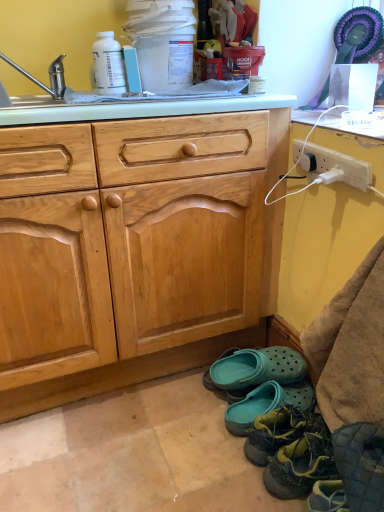
The height and width of the screenshot is (512, 384). What do you see at coordinates (107, 65) in the screenshot?
I see `white plastic bottle at upper left` at bounding box center [107, 65].

The height and width of the screenshot is (512, 384). I want to click on teal rubber clogs at lower center, which ranks as the second footwear in back-to-front order, so click(267, 404).

The height and width of the screenshot is (512, 384). What do you see at coordinates (300, 467) in the screenshot?
I see `green rubber shoes at lower right, the fourth footwear positioned from the back` at bounding box center [300, 467].

Identify the location of green rubber shoes at lower right, the fourth footwear positioned from the back. This screenshot has height=512, width=384. [300, 467].

You are a GUI agent. You are given a task and a screenshot of the screen. Output one action in this format:
    pyautogui.click(x=<x>, y=<y>)
    Task: Click on the white glossy countertop at upper right
    This screenshot has width=384, height=512.
    Given the screenshot: What is the action you would take?
    pyautogui.click(x=356, y=124)

Describe the element at coordinates (332, 165) in the screenshot. I see `white plastic power outlet at right` at that location.

The height and width of the screenshot is (512, 384). I want to click on white plastic power outlet at right, so click(x=332, y=165).

Where is `white plastic bottle at upper left`? The height and width of the screenshot is (512, 384). white plastic bottle at upper left is located at coordinates (107, 65).

Which point is more distant from viewer, (369, 178) or (37, 84)?

The point (37, 84) is behind.

Which is in front, white plastic power outlet at right or brushed metal faucet at upper left?

white plastic power outlet at right is in front.

Locate an element on the screen. power outlet to the right of brushed metal faucet at upper left is located at coordinates tap(332, 165).

In the scene shown: From a real-world perspective, which is physically below, white plastic power outlet at right or brushed metal faucet at upper left?

In real-world perspective, white plastic power outlet at right is lower.

In the image, is white plastic bottle at upper left on the left side or the right side of teal rubber clogs at lower right, acting as the 2th footwear starting from the front?

white plastic bottle at upper left is positioned on teal rubber clogs at lower right, acting as the 2th footwear starting from the front,'s left side.

Does point (115, 59) appear closer or farther from the camera than point (312, 423)?

Clearly, point (115, 59) is more distant from the camera than point (312, 423).

Is white plastic bottle at upper left thinner than teal rubber clogs at lower right, acting as the 2th footwear starting from the front?

Yes, white plastic bottle at upper left is thinner than teal rubber clogs at lower right, acting as the 2th footwear starting from the front.

Is white plastic bottle at upper left next to teal rubber clogs at lower right, which appears as the 3th footwear when viewed from the back, and touching it?

No, white plastic bottle at upper left is not next to teal rubber clogs at lower right, which appears as the 3th footwear when viewed from the back.

In terms of height, does white glossy countertop at upper right look taller or shorter compared to teal rubber clogs at lower center, placed as the third footwear when sorted from front to back?

In the image, white glossy countertop at upper right appears to be shorter than teal rubber clogs at lower center, placed as the third footwear when sorted from front to back.

From a real-world perspective, is white glossy countertop at upper right under teal rubber clogs at lower center, placed as the third footwear when sorted from front to back?

No, from a real-world perspective, white glossy countertop at upper right is not beneath teal rubber clogs at lower center, placed as the third footwear when sorted from front to back.

Does point (361, 120) come closer to viewer compared to point (269, 399)?

Yes, point (361, 120) is closer to viewer.

Considering the relative sizes of teal rubber clogs at lower right, which appears as the 3th footwear when viewed from the back, and teal rubber clogs at lower center, placed as the third footwear when sorted from front to back, in the image provided, is teal rubber clogs at lower right, which appears as the 3th footwear when viewed from the back, smaller than teal rubber clogs at lower center, placed as the third footwear when sorted from front to back,?

Actually, teal rubber clogs at lower right, which appears as the 3th footwear when viewed from the back, might be larger than teal rubber clogs at lower center, placed as the third footwear when sorted from front to back.

Would you say teal rubber clogs at lower right, acting as the 2th footwear starting from the front, is a long distance from teal rubber clogs at lower center, placed as the third footwear when sorted from front to back?

That's not correct — teal rubber clogs at lower right, acting as the 2th footwear starting from the front, is a little close to teal rubber clogs at lower center, placed as the third footwear when sorted from front to back.

Measure the distance from teal rubber clogs at lower right, which appears as the 3th footwear when viewed from the back, to teal rubber clogs at lower center, placed as the third footwear when sorted from front to back.

teal rubber clogs at lower right, which appears as the 3th footwear when viewed from the back, is 2.96 inches from teal rubber clogs at lower center, placed as the third footwear when sorted from front to back.

Do you think teal rubber clogs at lower right, acting as the 2th footwear starting from the front, is within teal rubber clogs at lower center, which ranks as the second footwear in back-to-front order, or outside of it?

teal rubber clogs at lower right, acting as the 2th footwear starting from the front, is outside teal rubber clogs at lower center, which ranks as the second footwear in back-to-front order.

Who is shorter, white plastic bottle at upper left or green rubber shoes at lower right, acting as the first footwear starting from the front?

green rubber shoes at lower right, acting as the first footwear starting from the front.

Could you tell me if white plastic bottle at upper left is turned towards green rubber shoes at lower right, the fourth footwear positioned from the back?

No.

How different are the orientations of white plastic bottle at upper left and green rubber shoes at lower right, the fourth footwear positioned from the back, in degrees?

There is a 108-degree angle between the facing directions of white plastic bottle at upper left and green rubber shoes at lower right, the fourth footwear positioned from the back.

From a real-world perspective, is white plastic bottle at upper left on top of green rubber shoes at lower right, the fourth footwear positioned from the back?

Correct, in the physical world, white plastic bottle at upper left is higher than green rubber shoes at lower right, the fourth footwear positioned from the back.

Identify the location of the 3rd footwear positioned below the white plastic power outlet at right (from a real-world perspective). (258, 368).

How far apart are white plastic power outlet at right and teal rubber clogs at lower center, which appears as the first footwear when viewed from the back?

61.28 centimeters.

Is white plastic power outlet at right located outside teal rubber clogs at lower center, which appears as the first footwear when viewed from the back?

Yes.

Considering the sizes of objects teal rubber clogs at lower center, which is counted as the 4th footwear, starting from the front, and teal rubber clogs at lower right, which appears as the 3th footwear when viewed from the back, in the image provided, who is smaller, teal rubber clogs at lower center, which is counted as the 4th footwear, starting from the front, or teal rubber clogs at lower right, which appears as the 3th footwear when viewed from the back,?

teal rubber clogs at lower center, which is counted as the 4th footwear, starting from the front, is smaller.

Considering the relative sizes of teal rubber clogs at lower center, which is counted as the 4th footwear, starting from the front, and teal rubber clogs at lower right, which appears as the 3th footwear when viewed from the back, in the image provided, is teal rubber clogs at lower center, which is counted as the 4th footwear, starting from the front, taller than teal rubber clogs at lower right, which appears as the 3th footwear when viewed from the back,?

In fact, teal rubber clogs at lower center, which is counted as the 4th footwear, starting from the front, may be shorter than teal rubber clogs at lower right, which appears as the 3th footwear when viewed from the back.

Could you measure the distance between teal rubber clogs at lower center, which appears as the first footwear when viewed from the back, and teal rubber clogs at lower right, which appears as the 3th footwear when viewed from the back?

teal rubber clogs at lower center, which appears as the first footwear when viewed from the back, is 7.27 inches away from teal rubber clogs at lower right, which appears as the 3th footwear when viewed from the back.

From a real-world perspective, is teal rubber clogs at lower center, which is counted as the 4th footwear, starting from the front, under teal rubber clogs at lower right, which appears as the 3th footwear when viewed from the back?

Correct, in the physical world, teal rubber clogs at lower center, which is counted as the 4th footwear, starting from the front, is lower than teal rubber clogs at lower right, which appears as the 3th footwear when viewed from the back.

Where is `power outlet that is on the right side of brushed metal faucet at upper left`? The image size is (384, 512). power outlet that is on the right side of brushed metal faucet at upper left is located at coordinates (332, 165).

Locate an element on the screen. The height and width of the screenshot is (512, 384). the 2nd footwear in front of the white plastic bottle at upper left is located at coordinates pyautogui.click(x=280, y=432).

Based on their spatial positions, is teal rubber clogs at lower center, which appears as the first footwear when viewed from the back, or green rubber shoes at lower right, the fourth footwear positioned from the back, further from teal rubber clogs at lower right, acting as the 2th footwear starting from the front?

The object further to teal rubber clogs at lower right, acting as the 2th footwear starting from the front, is teal rubber clogs at lower center, which appears as the first footwear when viewed from the back.

Looking at the image, which one is located closer to white plastic power outlet at right, white glossy countertop at upper right or teal rubber clogs at lower center, which is counted as the 4th footwear, starting from the front?

The object closer to white plastic power outlet at right is white glossy countertop at upper right.

Looking at the image, which one is located further to white plastic bottle at upper left, white glossy countertop at upper right or green rubber shoes at lower right, the fourth footwear positioned from the back?

The object further to white plastic bottle at upper left is green rubber shoes at lower right, the fourth footwear positioned from the back.

From the image, which object appears to be farther from teal rubber clogs at lower center, which appears as the first footwear when viewed from the back, white plastic power outlet at right or brushed metal faucet at upper left?

Based on the image, brushed metal faucet at upper left appears to be further to teal rubber clogs at lower center, which appears as the first footwear when viewed from the back.

In the scene shown: Estimate the real-world distances between objects in this image. Which object is closer to white plastic power outlet at right, teal rubber clogs at lower center, which ranks as the second footwear in back-to-front order, or white glossy countertop at upper right?

white glossy countertop at upper right.

From the image, which object appears to be farther from brushed metal faucet at upper left, teal rubber clogs at lower center, which is counted as the 4th footwear, starting from the front, or white plastic bottle at upper left?

teal rubber clogs at lower center, which is counted as the 4th footwear, starting from the front, is further to brushed metal faucet at upper left.

Estimate the real-world distances between objects in this image. Which object is further from teal rubber clogs at lower right, acting as the 2th footwear starting from the front, brushed metal faucet at upper left or teal rubber clogs at lower center, placed as the third footwear when sorted from front to back?

brushed metal faucet at upper left.

Based on their spatial positions, is teal rubber clogs at lower center, placed as the third footwear when sorted from front to back, or white plastic power outlet at right closer to green rubber shoes at lower right, the fourth footwear positioned from the back?

teal rubber clogs at lower center, placed as the third footwear when sorted from front to back, lies closer to green rubber shoes at lower right, the fourth footwear positioned from the back, than the other object.

I want to click on power outlet between white glossy countertop at upper right and teal rubber clogs at lower center, which ranks as the second footwear in back-to-front order, in the vertical direction, so click(332, 165).

At what (x,y) coordinates should I click in order to perform the action: click on power outlet between brushed metal faucet at upper left and white glossy countertop at upper right from left to right. Please return your answer as a coordinate pair (x, y). Looking at the image, I should click on (332, 165).

In order to click on power outlet between brushed metal faucet at upper left and teal rubber clogs at lower center, which ranks as the second footwear in back-to-front order, in the vertical direction in this screenshot , I will do `click(332, 165)`.

Locate an element on the screen. sink between white plastic bottle at upper left and teal rubber clogs at lower center, which appears as the first footwear when viewed from the back, in the vertical direction is located at coordinates (50, 80).